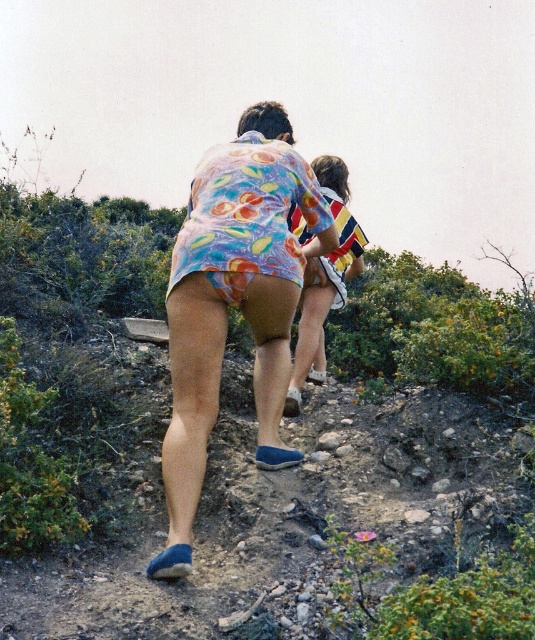
You are a hiker planning to cross a narrow rocky path. You see the floral fabric shorts at center and the striped fabric shirt at upper center. Which clothing item is wider, and why does it matter for your path?

The floral fabric shorts at center is wider than the striped fabric shirt at upper center. This means the shorts may block your path more, so you should be cautious when passing through the narrow area.